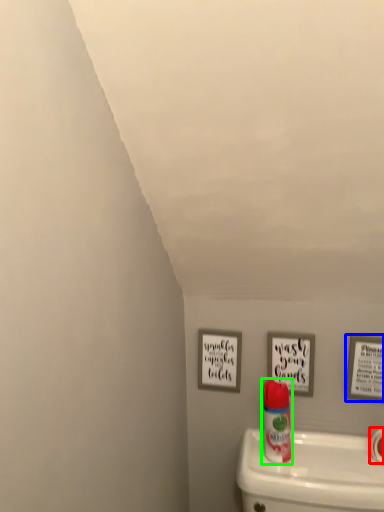
Question: Which object is positioned farthest from toilet paper (highlighted by a red box)? Select from picture frame (highlighted by a blue box) and cleaning product (highlighted by a green box).

Choices:
 (A) picture frame
 (B) cleaning product

Answer: (B)